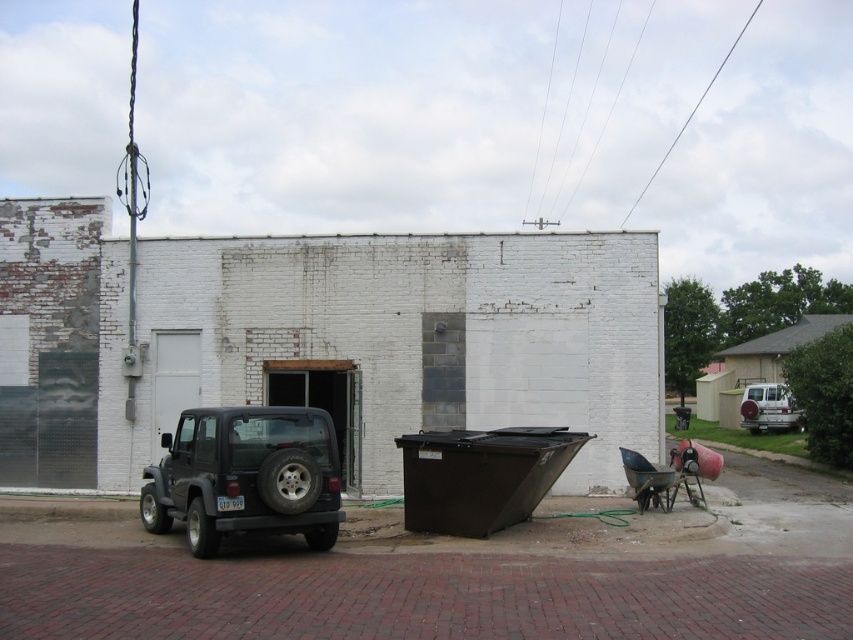
Question: Is matte black suv at left thinner than silver metallic suv at right?

Choices:
 (A) no
 (B) yes

Answer: (A)

Question: Is matte black suv at left smaller than silver metallic suv at right?

Choices:
 (A) yes
 (B) no

Answer: (B)

Question: Can you confirm if matte black suv at left is smaller than silver metallic suv at right?

Choices:
 (A) no
 (B) yes

Answer: (A)